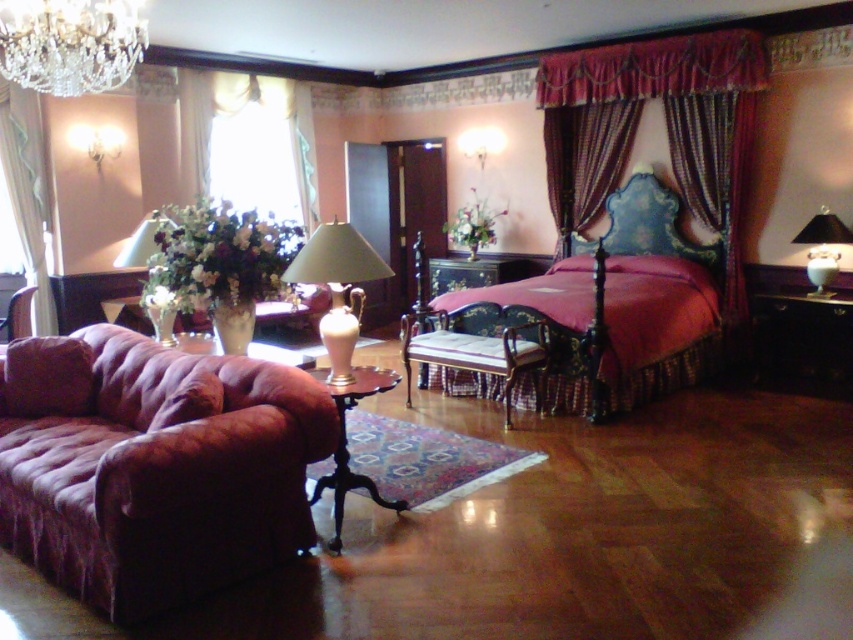
You are standing in the bedroom and want to determine the relative positions of two points marked in the image. Which point is closer to you, point (312,198) or point (334,500)?

Point (312,198) is further to the camera than point (334,500), so point (334,500) is closer to you.